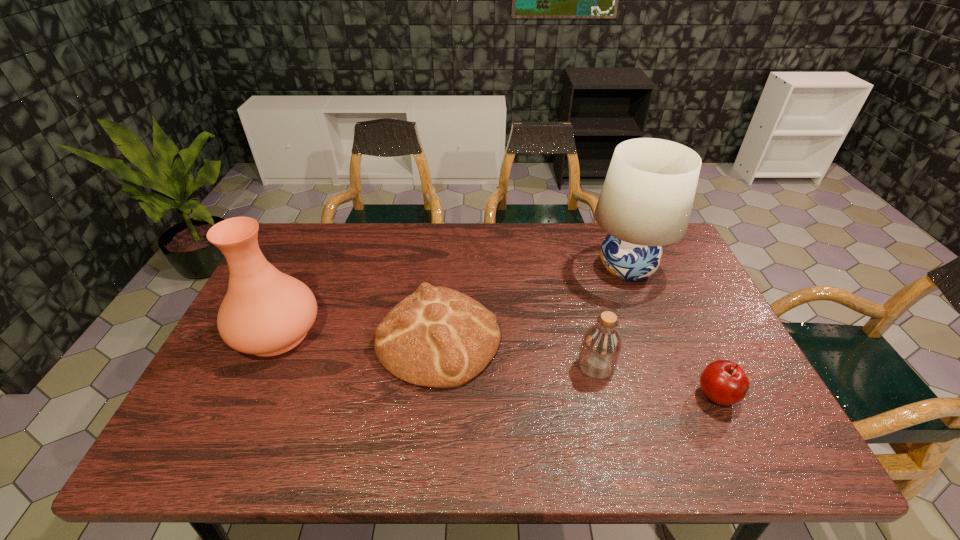
Identify the location of vacant space at the right edge. (736, 354).

This screenshot has width=960, height=540. In the image, there is a desktop. What are the coordinates of `vacant space at the far left corner` in the screenshot? It's located at (308, 231).

Where is `free location at the near left corner`? This screenshot has height=540, width=960. free location at the near left corner is located at coordinates (230, 460).

The height and width of the screenshot is (540, 960). Find the location of `vacant space that is in between the bread and the apple`. vacant space that is in between the bread and the apple is located at coordinates (578, 366).

Image resolution: width=960 pixels, height=540 pixels. What are the coordinates of `vacant space in between the leftmost object and the apple` in the screenshot? It's located at (497, 363).

I want to click on free space between the apple and the lampshade, so click(x=672, y=332).

At what (x,y) coordinates should I click in order to perform the action: click on vacant area that lies between the lampshade and the apple. Please return your answer as a coordinate pair (x, y). The height and width of the screenshot is (540, 960). Looking at the image, I should click on (672, 332).

At what (x,y) coordinates should I click in order to perform the action: click on free space between the vase and the fourth object from right to left. Please return your answer as a coordinate pair (x, y). This screenshot has width=960, height=540. Looking at the image, I should click on (358, 335).

Where is `the second closest object relative to the third tallest object`? the second closest object relative to the third tallest object is located at coordinates (439, 338).

The image size is (960, 540). I want to click on object that is the second closest to the vase, so click(601, 346).